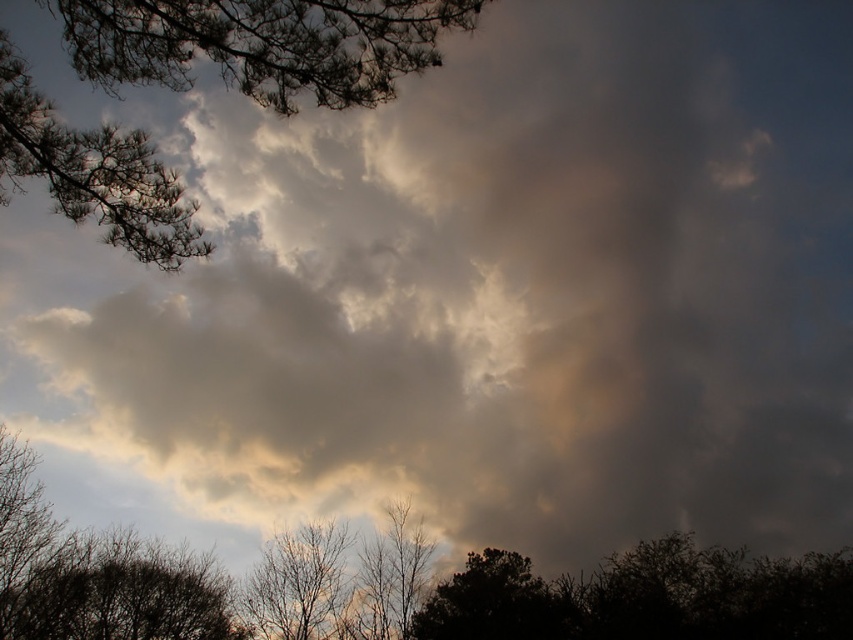
Question: Which point appears closest to the camera in this image?

Choices:
 (A) (x=328, y=68)
 (B) (x=585, y=608)

Answer: (A)

Question: Does brown textured branches at upper left appear over brown textured tree at lower left?

Choices:
 (A) no
 (B) yes

Answer: (B)

Question: Does brown textured branches at upper left have a greater width compared to brown textured tree at lower center?

Choices:
 (A) yes
 (B) no

Answer: (B)

Question: Based on their relative distances, which object is nearer to the dark brown bark tree at center?

Choices:
 (A) brown textured branches at upper left
 (B) dark green leafy tree at bottom
 (C) brown textured tree at lower left

Answer: (C)

Question: Estimate the real-world distances between objects in this image. Which object is closer to the brown textured tree at lower center?

Choices:
 (A) brown textured tree at lower left
 (B) brown textured branches at upper left
 (C) dark green leafy tree at bottom

Answer: (C)

Question: Is dark green leafy tree at bottom thinner than brown textured tree at lower center?

Choices:
 (A) yes
 (B) no

Answer: (B)